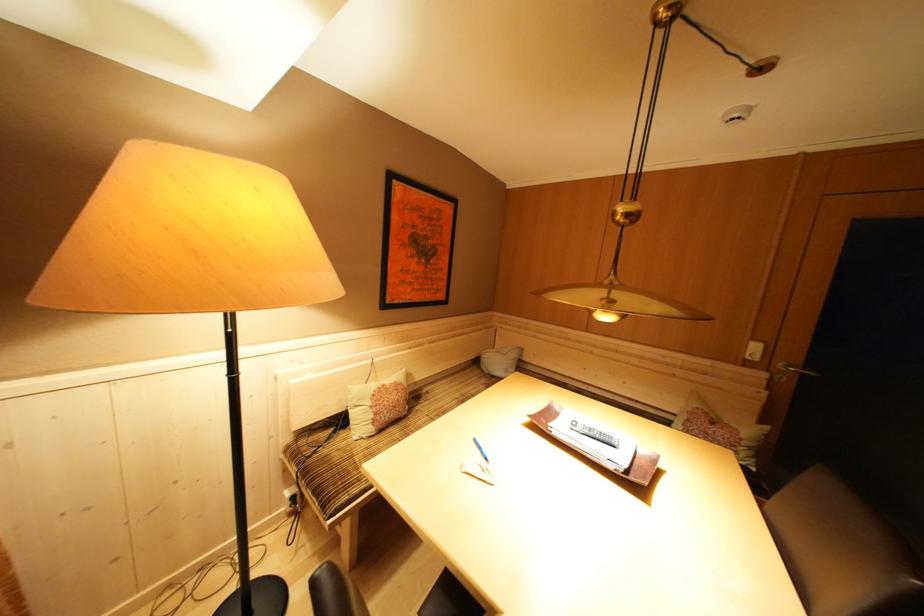
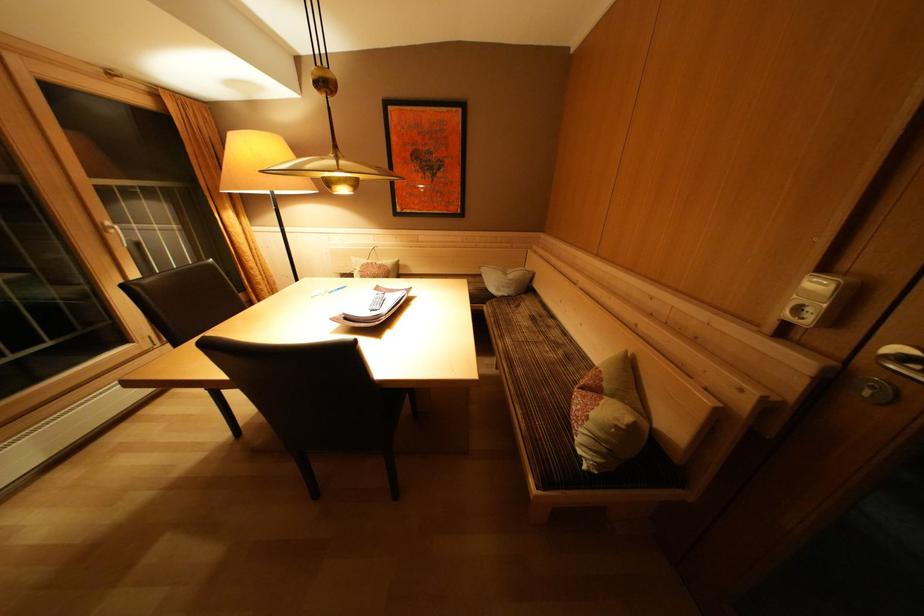
In the second image, find the point that corresponds to the point at 390,391 in the first image.

(379, 268)